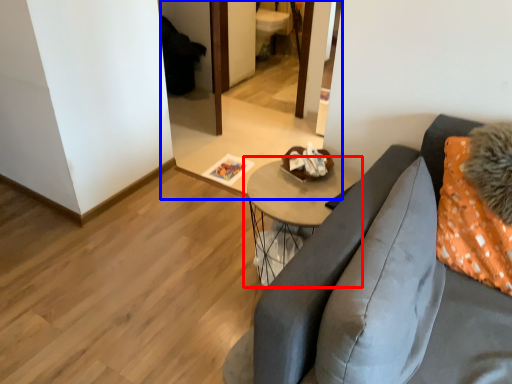
Question: Which point is further to the camera, table (highlighted by a red box) or mirror (highlighted by a blue box)?

Choices:
 (A) table
 (B) mirror

Answer: (B)